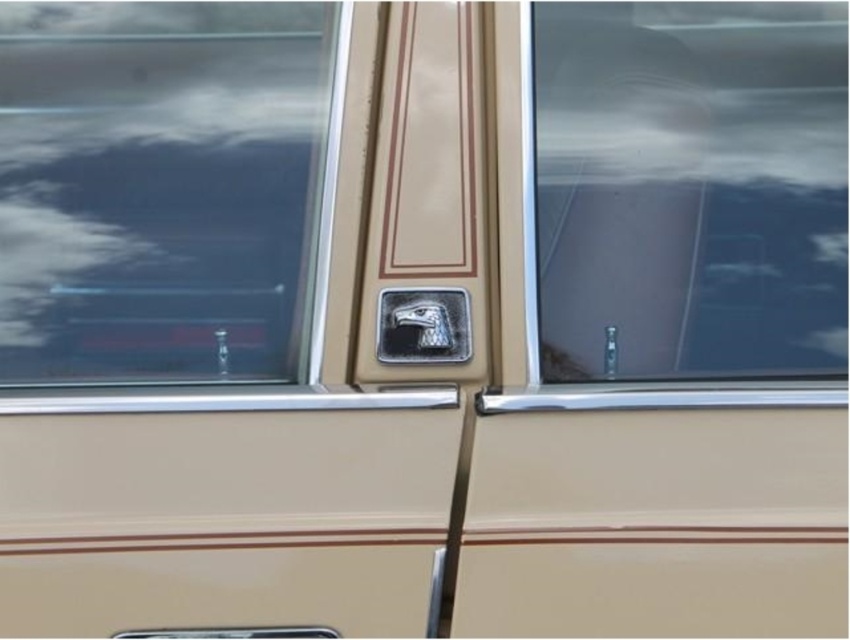
Question: Does transparent glass window at left appear under transparent glass window at center?

Choices:
 (A) yes
 (B) no

Answer: (B)

Question: Where is transparent glass window at center located in relation to metallic eagle head at center in the image?

Choices:
 (A) right
 (B) left

Answer: (A)

Question: Which object is positioned closest to the transparent glass window at center?

Choices:
 (A) metallic eagle head at center
 (B) transparent glass window at left

Answer: (A)

Question: Is transparent glass window at left thinner than transparent glass window at center?

Choices:
 (A) no
 (B) yes

Answer: (A)

Question: Considering the real-world distances, which object is closest to the transparent glass window at center?

Choices:
 (A) transparent glass window at left
 (B) metallic eagle head at center

Answer: (B)

Question: Which object appears closest to the camera in this image?

Choices:
 (A) transparent glass window at left
 (B) transparent glass window at center
 (C) metallic eagle head at center

Answer: (B)